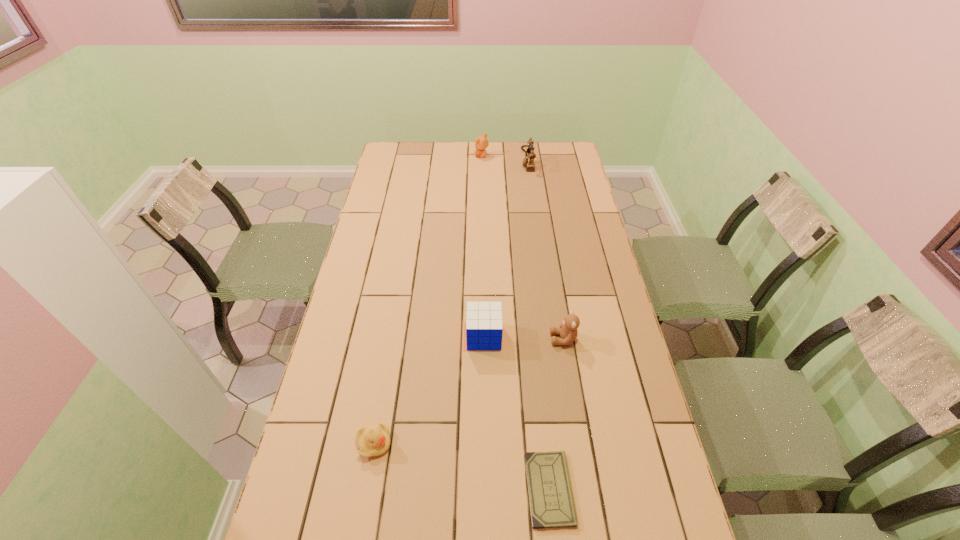
Locate an element on the screen. The image size is (960, 540). unoccupied position between the shortest object and the cube is located at coordinates (516, 413).

The height and width of the screenshot is (540, 960). Identify the location of vacant space in between the telephone and the cube. (506, 248).

Find the location of a particular element. empty location between the cube and the second shortest object is located at coordinates (429, 390).

Where is `vacant area that lies between the nearer teddy bear and the fifth tallest object`? This screenshot has width=960, height=540. vacant area that lies between the nearer teddy bear and the fifth tallest object is located at coordinates (468, 392).

The image size is (960, 540). Identify the location of free space between the second shortest object and the shortest object. (462, 467).

Find the location of a particular element. This screenshot has height=540, width=960. free space between the nearer teddy bear and the checkbook is located at coordinates (557, 414).

At what (x,y) coordinates should I click in order to perform the action: click on free space between the second shortest object and the checkbook. Please return your answer as a coordinate pair (x, y). Looking at the image, I should click on (462, 467).

Choose which object is the nearest neighbor to the shortest object. Please provide its 2D coordinates. Your answer should be formatted as a tuple, i.e. [(x, y)], where the tuple contains the x and y coordinates of a point satisfying the conditions above.

[(484, 327)]

Identify the location of object that stands as the fifth closest to the farther teddy bear. (551, 500).

I want to click on free space that satisfies the following two spatial constraints: 1. on the back side of the cube; 2. on the face of the left teddy bear, so click(x=483, y=156).